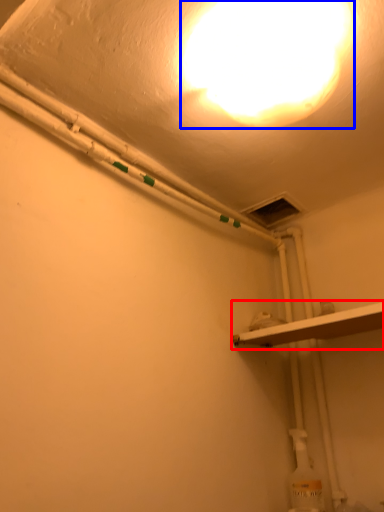
Question: Which of the following is the farthest to the observer, shelf (highlighted by a red box) or lamp (highlighted by a blue box)?

Choices:
 (A) shelf
 (B) lamp

Answer: (A)